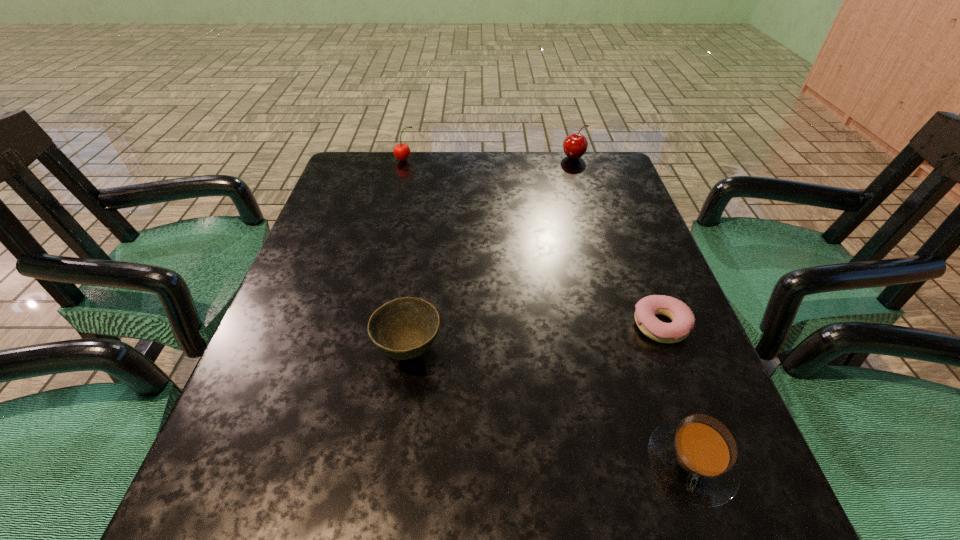
What are the coordinates of `blank space at the near edge of the desktop` in the screenshot? It's located at (373, 518).

At what (x,y) coordinates should I click in order to perform the action: click on free region at the left edge of the desktop. Please return your answer as a coordinate pair (x, y). Looking at the image, I should click on (231, 464).

Locate an element on the screen. The width and height of the screenshot is (960, 540). free space at the right edge of the desktop is located at coordinates (627, 331).

Where is `free space at the far left corner of the desktop`? This screenshot has height=540, width=960. free space at the far left corner of the desktop is located at coordinates coord(354,159).

The width and height of the screenshot is (960, 540). I want to click on free spot at the near left corner of the desktop, so click(x=270, y=534).

Where is `vacant space at the near right corner of the desktop`? Image resolution: width=960 pixels, height=540 pixels. vacant space at the near right corner of the desktop is located at coordinates (779, 535).

Where is `vacant area between the doughnut and the right cherry`? The height and width of the screenshot is (540, 960). vacant area between the doughnut and the right cherry is located at coordinates (617, 241).

Where is `free spot between the nearest object and the right cherry`? free spot between the nearest object and the right cherry is located at coordinates (633, 310).

Find the location of `free space between the doughnut and the bowl`. free space between the doughnut and the bowl is located at coordinates (535, 338).

What are the coordinates of `vacant area between the right cherry and the bowl` in the screenshot? It's located at (492, 254).